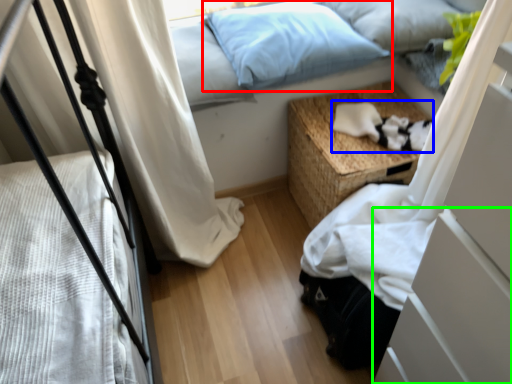
Question: Which object is positioned farthest from pillow (highlighted by a red box)? Select from cat (highlighted by a blue box) and drawer (highlighted by a green box).

Choices:
 (A) cat
 (B) drawer

Answer: (B)